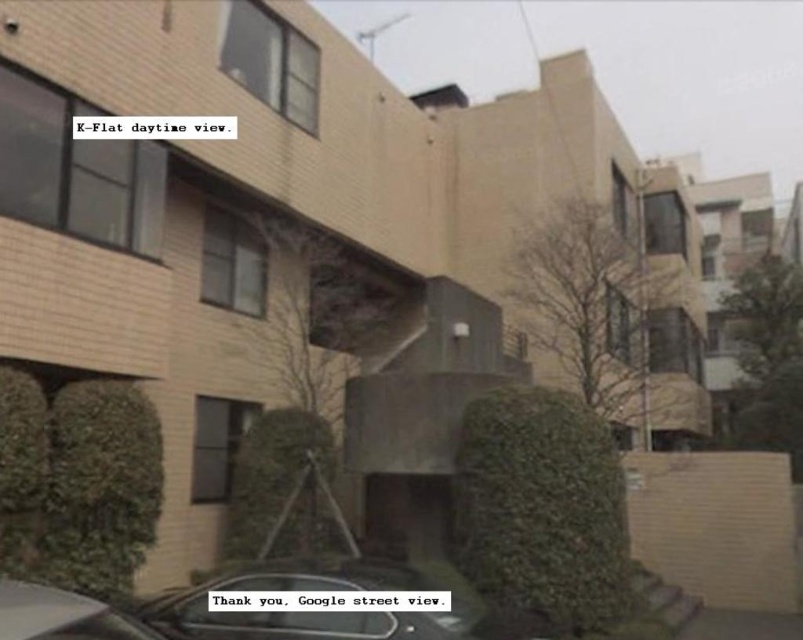
Question: Which point is closer to the camera?

Choices:
 (A) (100, 616)
 (B) (320, 579)

Answer: (A)

Question: Considering the relative positions of metallic gray car at lower center and shiny silver car at lower left in the image provided, where is metallic gray car at lower center located with respect to shiny silver car at lower left?

Choices:
 (A) above
 (B) below

Answer: (B)

Question: Does metallic gray car at lower center appear under shiny silver car at lower left?

Choices:
 (A) yes
 (B) no

Answer: (A)

Question: Among these objects, which one is nearest to the camera?

Choices:
 (A) metallic gray car at lower center
 (B) shiny silver car at lower left

Answer: (B)

Question: Does metallic gray car at lower center have a lesser width compared to shiny silver car at lower left?

Choices:
 (A) no
 (B) yes

Answer: (A)

Question: Which of the following is the closest to the observer?

Choices:
 (A) (151, 612)
 (B) (47, 618)

Answer: (B)